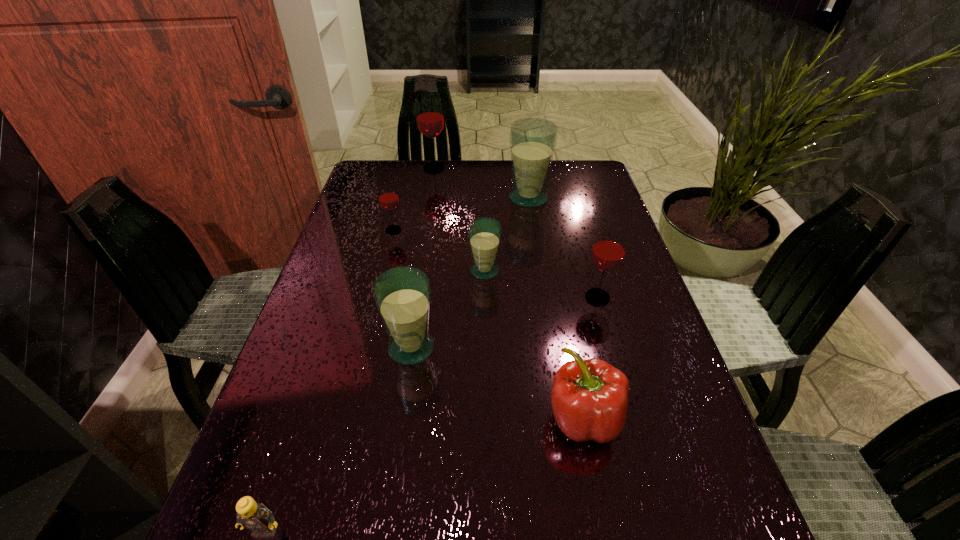
In the image, there is a desktop. Where is `vacant space at the far left corner`? This screenshot has width=960, height=540. vacant space at the far left corner is located at coordinates (368, 190).

Find the location of `vacant region at the far right corner`. vacant region at the far right corner is located at coordinates point(580,169).

I want to click on empty location between the third farthest object and the farthest blue glass, so click(x=461, y=214).

You are a GUI agent. You are given a task and a screenshot of the screen. Output one action in this format:
    pyautogui.click(x=<x>, y=<y>)
    Task: Click on the vacant space in between the second farthest blue glass and the nearest glass
    
    Given the screenshot: What is the action you would take?
    pyautogui.click(x=448, y=309)

Where is `free space between the second blue glass from right to left and the second red glass from right to left`? free space between the second blue glass from right to left and the second red glass from right to left is located at coordinates (459, 220).

I want to click on vacant space in between the rightmost glass and the farthest object, so click(x=516, y=233).

Identify the location of free spot between the leftmost red glass and the second nearest object. The height and width of the screenshot is (540, 960). (489, 325).

Identify the location of free spot between the second nearest object and the fifth nearest object. (534, 345).

Identify the location of free space between the leftmost blue glass and the seventh nearest object. This screenshot has height=540, width=960. (469, 273).

Image resolution: width=960 pixels, height=540 pixels. Find the location of `free space between the third farthest glass and the second red glass from left to right`. free space between the third farthest glass and the second red glass from left to right is located at coordinates (414, 199).